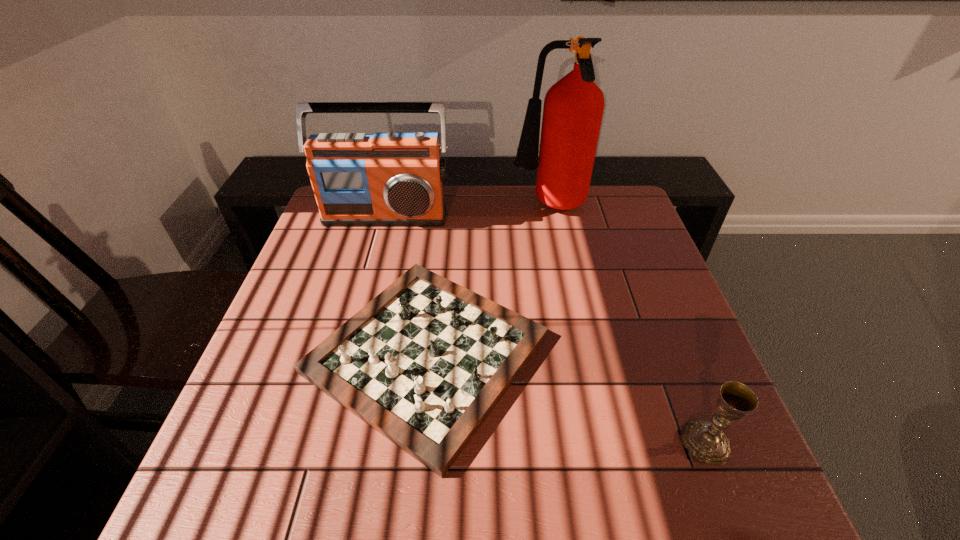
This screenshot has width=960, height=540. In order to click on object located in the near left corner section of the desktop in this screenshot , I will do `click(424, 363)`.

Locate an element on the screen. This screenshot has width=960, height=540. object at the far right corner is located at coordinates (573, 108).

Where is `object at the near right corner`? The height and width of the screenshot is (540, 960). object at the near right corner is located at coordinates (705, 440).

Identify the location of blank area at the far edge. (447, 208).

Locate an element on the screen. This screenshot has height=540, width=960. vacant space at the left edge of the desktop is located at coordinates (358, 249).

Identify the location of vacant space at the right edge of the desktop. This screenshot has width=960, height=540. (639, 240).

In order to click on vacant space at the far right corner of the desktop in this screenshot , I will do `click(591, 205)`.

You are a GUI agent. You are given a task and a screenshot of the screen. Output one action in this format:
    pyautogui.click(x=<x>, y=<y>)
    Task: Click on the vacant region between the rightmost object and the fire extinguisher
    
    Given the screenshot: What is the action you would take?
    pyautogui.click(x=627, y=325)

Locate an element on the screen. The width and height of the screenshot is (960, 540). vacant space in between the tallest object and the chalice is located at coordinates (627, 325).

Identify the location of empty space between the fire extinguisher and the second tallest object. Image resolution: width=960 pixels, height=540 pixels. (468, 212).